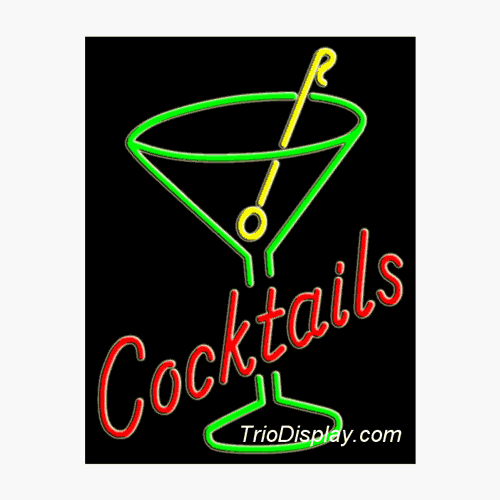
This screenshot has width=500, height=500. Identify the location of neon design. (274, 250), (253, 205), (271, 189), (268, 313), (256, 400).